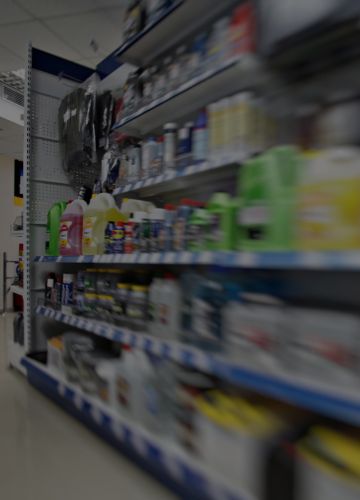
What are the coordinates of `blue and white shelf` in the screenshot? It's located at (149, 453).